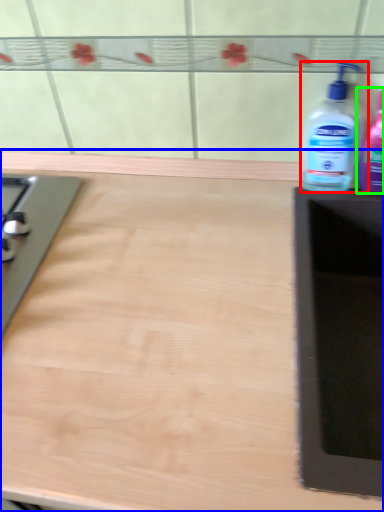
Question: Considering the real-world distances, which object is closest to bottle (highlighted by a red box)? countertop (highlighted by a blue box) or bottle (highlighted by a green box).

Choices:
 (A) countertop
 (B) bottle

Answer: (B)